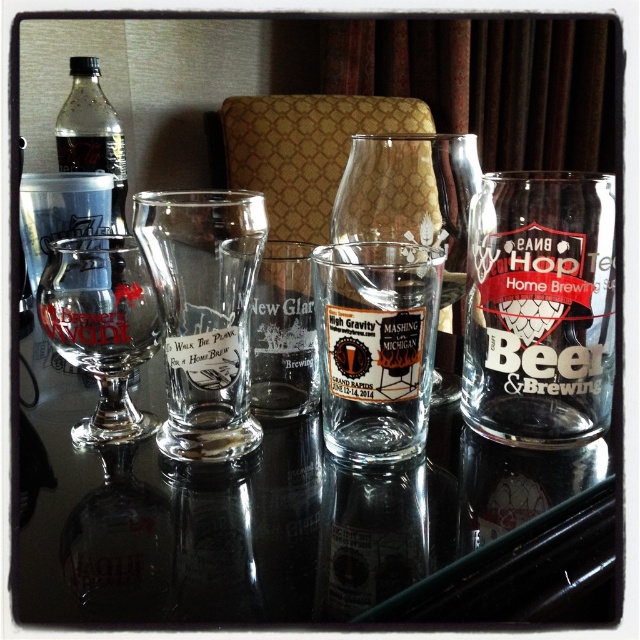
You are looking at the arrangement of glasses on the table. There are two points marked on the image, one at point (x=481, y=448) and the other at point (x=131, y=403). Which point is closer to your eyes?

Point (x=481, y=448) is closer to the camera than point (x=131, y=403), so the point at (x=481, y=448) is closer to your eyes.

You are a bartender preparing a drink and need to choose between the clear glass shot glass at center and the clear glass wine glass at left. Which glass is taller?

The clear glass shot glass at center is much taller than the clear glass wine glass at left according to the description provided.

You are a bartender arranging drinks on a table. You have a clear glass shot glass at center and a clear glass wine glass at left. A customer asks if the shot glass is closer to them than the wine glass. Can you confirm?

The clear glass shot glass at center is in front of the clear glass wine glass at left, so yes, the shot glass is closer to the customer than the wine glass.